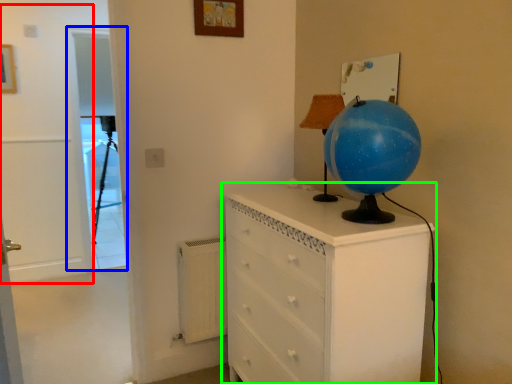
Question: Which object is positioned closest to door (highlighted by a red box)? Select from screen door (highlighted by a blue box) and chest of drawers (highlighted by a green box).

Choices:
 (A) screen door
 (B) chest of drawers

Answer: (A)